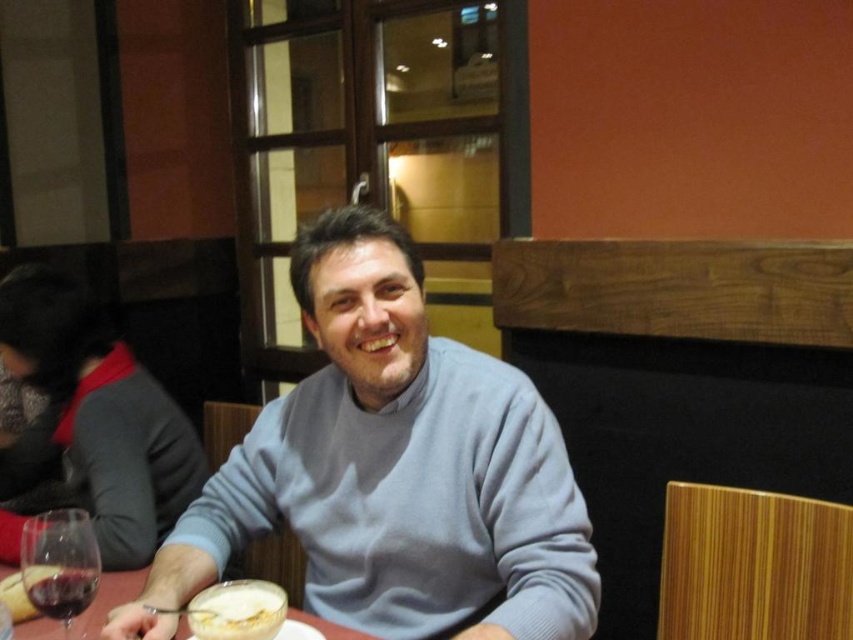
You are a customer at the restaurant and want to reach for the white creamy soup at lower center and the translucent glass at lower left. Which object is closer to your right hand if you are sitting at the table?

The white creamy soup at lower center is closer to your right hand because it is positioned on the right side of the translucent glass at lower left.

You are a food critic evaluating portion sizes. You see the white creamy soup at lower center and the translucent glass at lower left on the table. Which item has a larger volume?

The white creamy soup at lower center has a larger volume than the translucent glass at lower left according to the description.